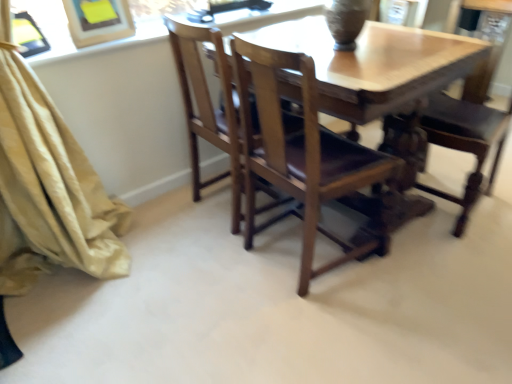
Where is `free space in front of wooden chair at center, acting as the 2th chair starting from the right`? Image resolution: width=512 pixels, height=384 pixels. free space in front of wooden chair at center, acting as the 2th chair starting from the right is located at coordinates (329, 327).